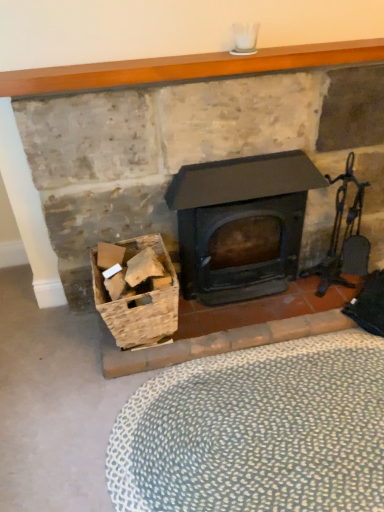
Locate an element on the screen. This screenshot has height=512, width=384. matte black stove at center is located at coordinates (185, 67).

This screenshot has height=512, width=384. What do you see at coordinates (257, 431) in the screenshot?
I see `white dotted rug at lower center` at bounding box center [257, 431].

Measure the distance between point (172, 293) and camera.

The depth of point (172, 293) is 1.47 meters.

What is the approximate width of smooth wooden mantle at upper center?

smooth wooden mantle at upper center is 5.72 inches in width.

At what (x,y) coordinates should I click in order to perform the action: click on matte black stove at center. Please return your answer as a coordinate pair (x, y). The width and height of the screenshot is (384, 512). Looking at the image, I should click on (185, 67).

Between wooden crate at lower left and white dotted rug at lower center, which one is positioned behind?

Positioned behind is wooden crate at lower left.

From a real-world perspective, which object stands above the other?

wooden crate at lower left.

Can you confirm if wooden crate at lower left is thinner than white dotted rug at lower center?

Yes.

Could white dotted rug at lower center be considered to be inside smooth wooden mantle at upper center?

No.

Which object is wider, smooth wooden mantle at upper center or white dotted rug at lower center?

With larger width is white dotted rug at lower center.

The image size is (384, 512). Find the location of `mantle above the white dotted rug at lower center (from a real-world perspective)`. mantle above the white dotted rug at lower center (from a real-world perspective) is located at coordinates (185, 67).

Based on their positions, is smooth wooden mantle at upper center located to the left or right of white dotted rug at lower center?

smooth wooden mantle at upper center is to the left of white dotted rug at lower center.

Does white dotted rug at lower center have a greater width compared to matte black stove at center?

Correct, the width of white dotted rug at lower center exceeds that of matte black stove at center.

Locate an element on the screen. fireplace above the white dotted rug at lower center (from the image's perspective) is located at coordinates (185, 67).

In terms of height, does white dotted rug at lower center look taller or shorter compared to matte black stove at center?

white dotted rug at lower center is shorter than matte black stove at center.

From the image's perspective, which object appears higher, white dotted rug at lower center or matte black stove at center?

From the image's view, matte black stove at center is above.

How many degrees apart are the facing directions of metallic dark brown fireplace tool set at right and smooth wooden mantle at upper center?

The angle between the facing direction of metallic dark brown fireplace tool set at right and the facing direction of smooth wooden mantle at upper center is 1.78 degrees.

Between metallic dark brown fireplace tool set at right and smooth wooden mantle at upper center, which one has larger size?

metallic dark brown fireplace tool set at right.

Considering the relative sizes of metallic dark brown fireplace tool set at right and smooth wooden mantle at upper center in the image provided, is metallic dark brown fireplace tool set at right shorter than smooth wooden mantle at upper center?

No.

Which is behind, metallic dark brown fireplace tool set at right or smooth wooden mantle at upper center?

metallic dark brown fireplace tool set at right.

What's the angular difference between metallic dark brown fireplace tool set at right and matte black wood burning stove at center's facing directions?

The angle between the facing direction of metallic dark brown fireplace tool set at right and the facing direction of matte black wood burning stove at center is 0.695 degrees.

Can you confirm if metallic dark brown fireplace tool set at right is thinner than matte black wood burning stove at center?

Correct, the width of metallic dark brown fireplace tool set at right is less than that of matte black wood burning stove at center.

Is metallic dark brown fireplace tool set at right outside of matte black wood burning stove at center?

That's correct, metallic dark brown fireplace tool set at right is outside of matte black wood burning stove at center.

Considering the positions of objects metallic dark brown fireplace tool set at right and matte black wood burning stove at center in the image provided, who is more to the left, metallic dark brown fireplace tool set at right or matte black wood burning stove at center?

matte black wood burning stove at center is more to the left.

From the image's perspective, which one is positioned lower, matte black stove at center or smooth wooden mantle at upper center?

matte black stove at center.

In the scene shown: Considering the relative positions of matte black stove at center and smooth wooden mantle at upper center in the image provided, is matte black stove at center to the left or to the right of smooth wooden mantle at upper center?

Clearly, matte black stove at center is on the right of smooth wooden mantle at upper center in the image.

Is matte black stove at center situated inside smooth wooden mantle at upper center or outside?

matte black stove at center exists outside the volume of smooth wooden mantle at upper center.

Between matte black stove at center and wooden crate at lower left, which one has larger size?

With larger size is matte black stove at center.

Is matte black stove at center oriented away from wooden crate at lower left?

Yes, matte black stove at center's orientation is away from wooden crate at lower left.

Would you say matte black stove at center is a long distance from wooden crate at lower left?

No.

Would you say matte black stove at center is inside or outside wooden crate at lower left?

matte black stove at center is spatially situated outside wooden crate at lower left.

This screenshot has height=512, width=384. I want to click on basket above the white dotted rug at lower center (from the image's perspective), so (139, 300).

Locate an element on the screen. plain located in front of the smooth wooden mantle at upper center is located at coordinates (257, 431).

Based on their spatial positions, is white dotted rug at lower center or matte black wood burning stove at center further from wooden crate at lower left?

white dotted rug at lower center.

Looking at the image, which one is located further to matte black wood burning stove at center, metallic dark brown fireplace tool set at right or wooden crate at lower left?

Based on the image, wooden crate at lower left appears to be further to matte black wood burning stove at center.

Looking at this image, estimate the real-world distances between objects in this image. Which object is further from metallic dark brown fireplace tool set at right, smooth wooden mantle at upper center or matte black stove at center?

matte black stove at center is further to metallic dark brown fireplace tool set at right.

When comparing their distances from white dotted rug at lower center, does matte black wood burning stove at center or wooden crate at lower left seem further?

The object further to white dotted rug at lower center is matte black wood burning stove at center.

Looking at the image, which one is located closer to matte black stove at center, smooth wooden mantle at upper center or wooden crate at lower left?

Among the two, smooth wooden mantle at upper center is located nearer to matte black stove at center.

Estimate the real-world distances between objects in this image. Which object is closer to white dotted rug at lower center, smooth wooden mantle at upper center or matte black wood burning stove at center?

The object closer to white dotted rug at lower center is matte black wood burning stove at center.

From the image, which object appears to be nearer to metallic dark brown fireplace tool set at right, white dotted rug at lower center or wooden crate at lower left?

→ white dotted rug at lower center.

Considering their positions, is matte black wood burning stove at center positioned closer to wooden crate at lower left than metallic dark brown fireplace tool set at right?

Among the two, matte black wood burning stove at center is located nearer to wooden crate at lower left.

The height and width of the screenshot is (512, 384). What are the coordinates of `wood burning stove between smooth wooden mantle at upper center and white dotted rug at lower center in the up-down direction` in the screenshot? It's located at (240, 218).

Locate an element on the screen. This screenshot has width=384, height=512. fireplace between smooth wooden mantle at upper center and white dotted rug at lower center from top to bottom is located at coordinates (185, 67).

This screenshot has height=512, width=384. What are the coordinates of `fireplace between smooth wooden mantle at upper center and matte black wood burning stove at center vertically` in the screenshot? It's located at (185, 67).

Identify the location of wood burning stove between wooden crate at lower left and metallic dark brown fireplace tool set at right. (240, 218).